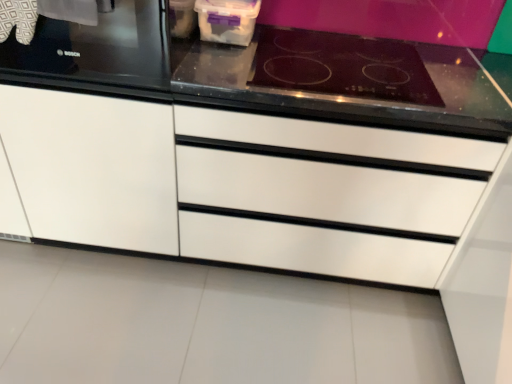
Question: Is black glass stove at upper left bigger than white matte cabinet at left?

Choices:
 (A) no
 (B) yes

Answer: (A)

Question: Is white matte cabinet at left a part of black glass stove at upper left?

Choices:
 (A) no
 (B) yes

Answer: (A)

Question: Are black glass stove at upper left and white matte cabinet at left making contact?

Choices:
 (A) yes
 (B) no

Answer: (B)

Question: From a real-world perspective, is black glass stove at upper left beneath white matte cabinet at left?

Choices:
 (A) yes
 (B) no

Answer: (B)

Question: Considering the relative positions of black glass stove at upper left and white matte cabinet at left in the image provided, is black glass stove at upper left to the left of white matte cabinet at left from the viewer's perspective?

Choices:
 (A) no
 (B) yes

Answer: (A)

Question: Considering the positions of black glass cooktop at upper right and white glossy drawer at center in the image, is black glass cooktop at upper right wider or thinner than white glossy drawer at center?

Choices:
 (A) wide
 (B) thin

Answer: (B)

Question: From a real-world perspective, is black glass cooktop at upper right physically located above or below white glossy drawer at center?

Choices:
 (A) above
 (B) below

Answer: (A)

Question: In terms of height, does black glass cooktop at upper right look taller or shorter compared to white glossy drawer at center?

Choices:
 (A) short
 (B) tall

Answer: (A)

Question: From the image's perspective, is black glass cooktop at upper right above or below white glossy drawer at center?

Choices:
 (A) below
 (B) above

Answer: (B)

Question: Relative to white glossy drawer at center, is white matte cabinet at left in front or behind?

Choices:
 (A) front
 (B) behind

Answer: (A)

Question: From the image's perspective, is white matte cabinet at left located above or below white glossy drawer at center?

Choices:
 (A) below
 (B) above

Answer: (B)

Question: From a real-world perspective, relative to white glossy drawer at center, is white matte cabinet at left vertically above or below?

Choices:
 (A) above
 (B) below

Answer: (A)

Question: Is white matte cabinet at left spatially inside white glossy drawer at center, or outside of it?

Choices:
 (A) outside
 (B) inside

Answer: (A)

Question: From the image's perspective, relative to black glass cooktop at upper right, is white matte cabinet at left above or below?

Choices:
 (A) above
 (B) below

Answer: (B)

Question: From their relative heights in the image, would you say white matte cabinet at left is taller or shorter than black glass cooktop at upper right?

Choices:
 (A) tall
 (B) short

Answer: (A)